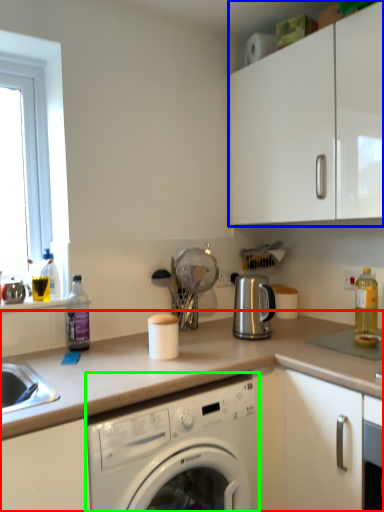
Question: Based on their relative distances, which object is nearer to countertop (highlighted by a red box)? Choose from cabinetry (highlighted by a blue box) and washing machine (highlighted by a green box).

Choices:
 (A) cabinetry
 (B) washing machine

Answer: (B)